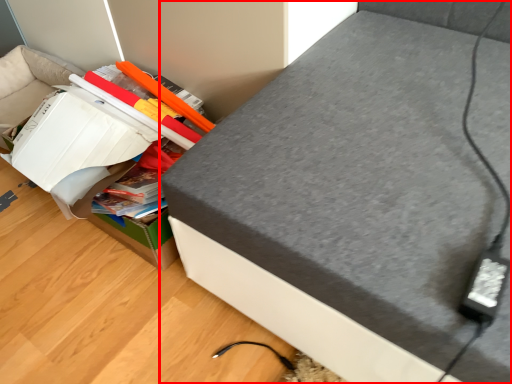
Question: From the image's perspective, where is furniture (annotated by the red box) located relative to cardboard box?

Choices:
 (A) below
 (B) above

Answer: (B)